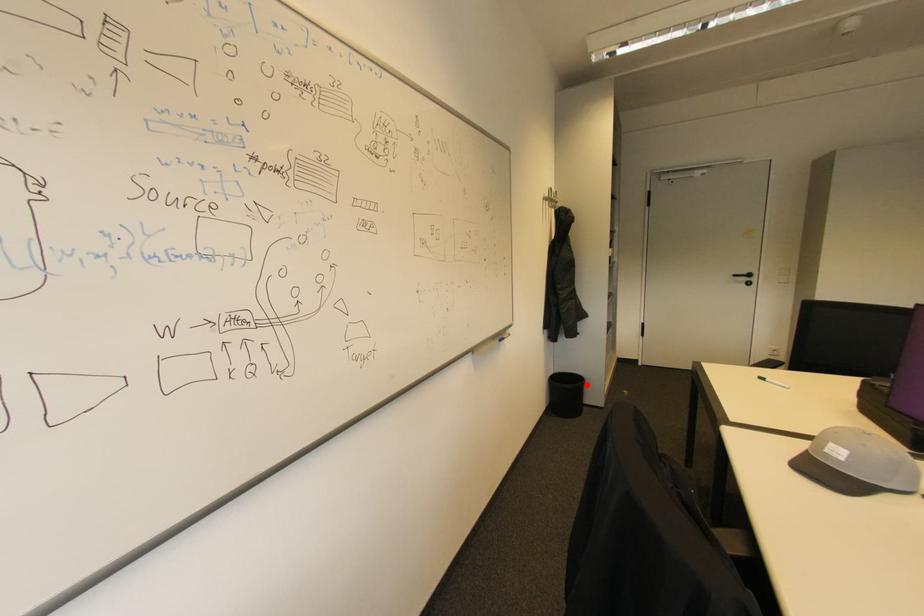
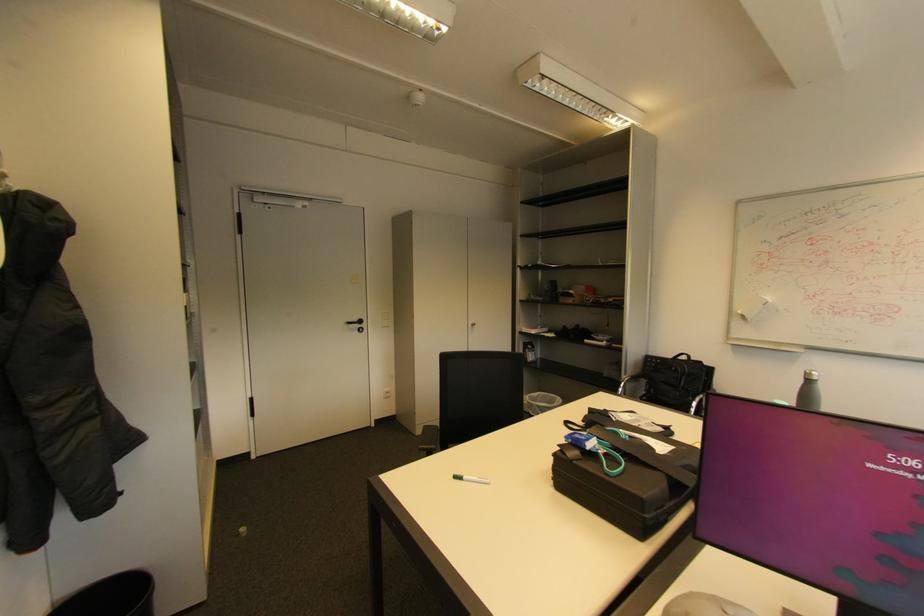
Question: I am providing you with two images of the same scene from different viewpoints. Given a red point in image1, look at the same physical point in image2. Is it:

Choices:
 (A) Closer to the viewpoint
 (B) Farther from the viewpoint

Answer: (A)